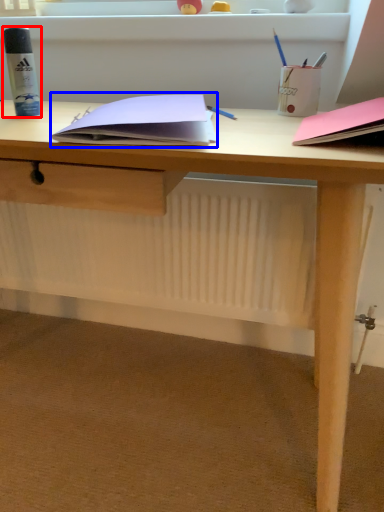
Question: Which object appears closest to the camera in this image, stationery (highlighted by a red box) or paperback book (highlighted by a blue box)?

Choices:
 (A) stationery
 (B) paperback book

Answer: (B)